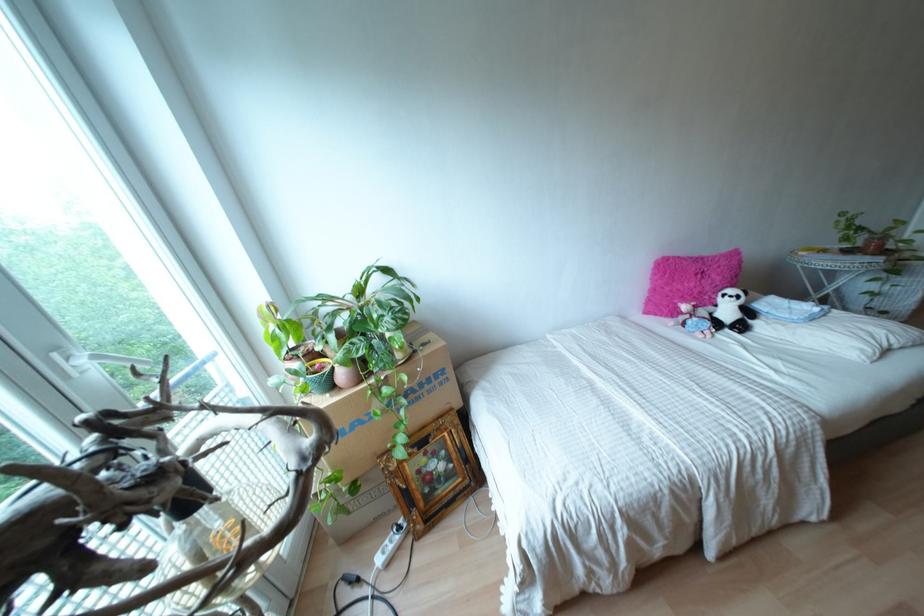
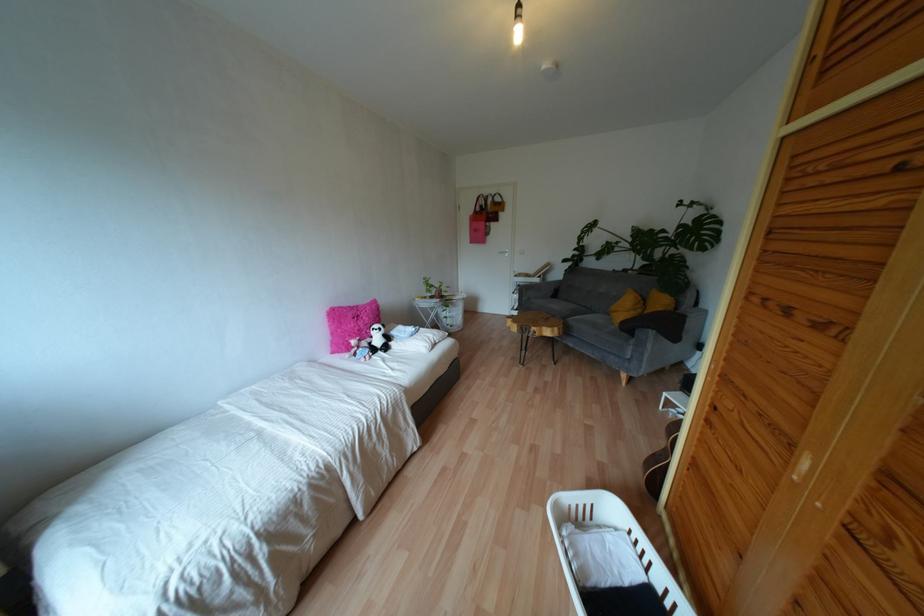
Where in the second image is the point corresponding to pixel 759 305 from the first image?

(393, 331)